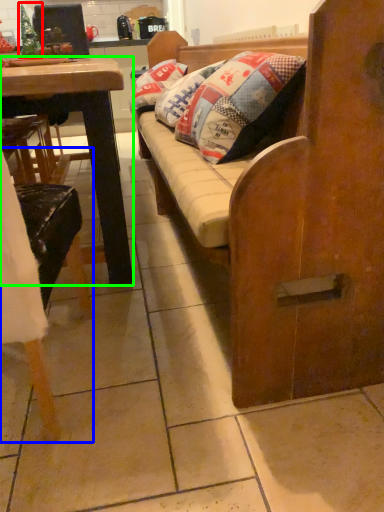
Question: Estimate the real-world distances between objects in this image. Which object is closer to christmas tree (highlighted by a red box), chair (highlighted by a blue box) or desk (highlighted by a green box)?

Choices:
 (A) chair
 (B) desk

Answer: (B)